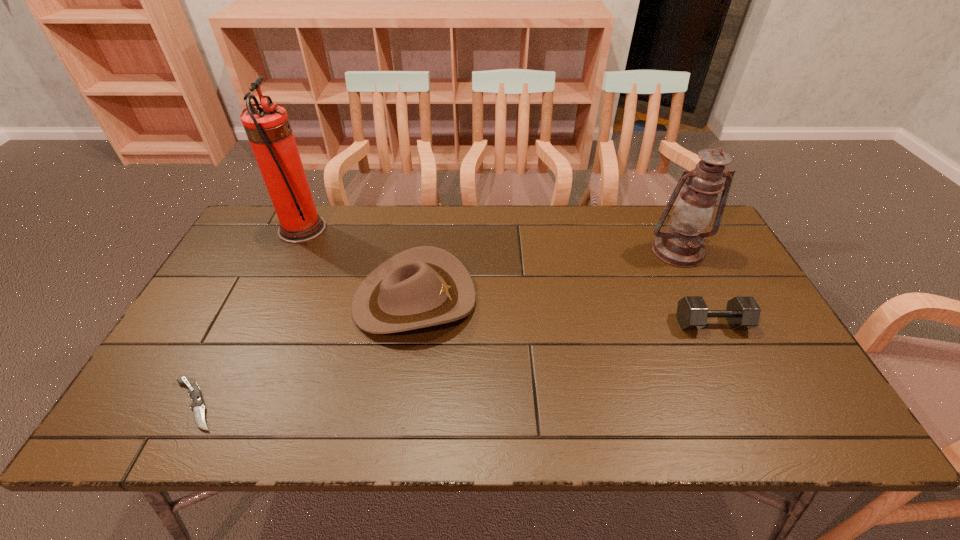
Locate an element on the screen. The width and height of the screenshot is (960, 540). free spot between the second shortest object and the nearest object is located at coordinates (453, 364).

Where is `free spot between the second shortest object and the tallest object`? free spot between the second shortest object and the tallest object is located at coordinates (507, 276).

This screenshot has height=540, width=960. Identify the location of free point between the fourth shortest object and the tallest object. (490, 240).

Find the location of a particular element. Image resolution: width=960 pixels, height=540 pixels. vacant region between the fire extinguisher and the fourth tallest object is located at coordinates (507, 276).

Find the location of `vacant space that's between the third shortest object and the fourth tallest object`. vacant space that's between the third shortest object and the fourth tallest object is located at coordinates (563, 312).

Identify the location of empty space between the third shortest object and the pocketknife. This screenshot has width=960, height=540. (304, 352).

In order to click on empty space between the second tallest object and the third shortest object in this screenshot , I will do `click(546, 275)`.

Locate an element on the screen. The height and width of the screenshot is (540, 960). vacant space that's between the third shortest object and the fourth shortest object is located at coordinates (546, 275).

Locate an element on the screen. The height and width of the screenshot is (540, 960). free space between the dumbbell and the pocketknife is located at coordinates (453, 364).

Identify the location of free spot between the dumbbell and the second tallest object. The image size is (960, 540). (695, 287).